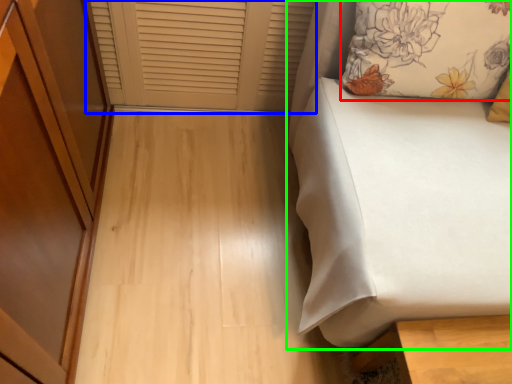
Question: Based on their relative distances, which object is farther from pillow (highlighted by a red box)? Choose from window frame (highlighted by a blue box) and furniture (highlighted by a green box).

Choices:
 (A) window frame
 (B) furniture

Answer: (A)